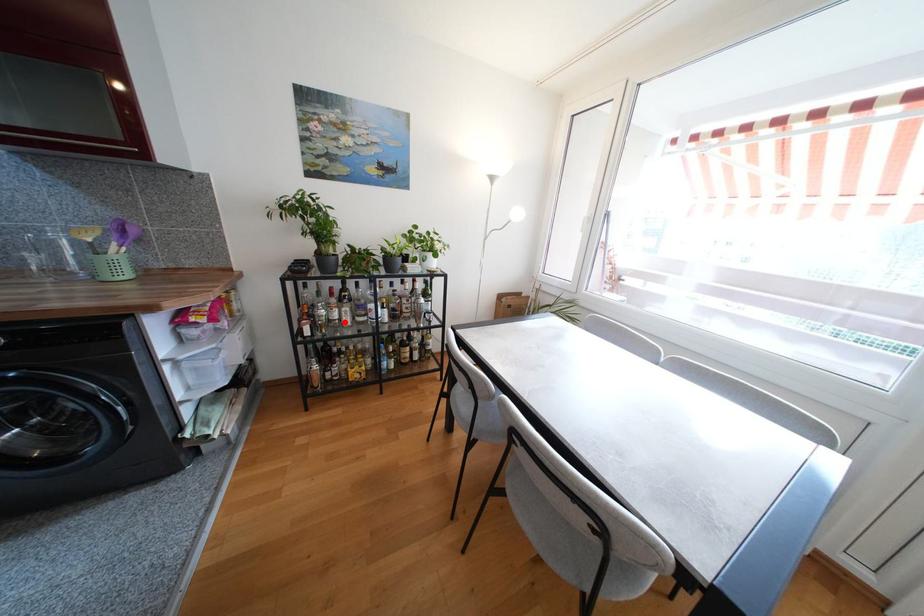
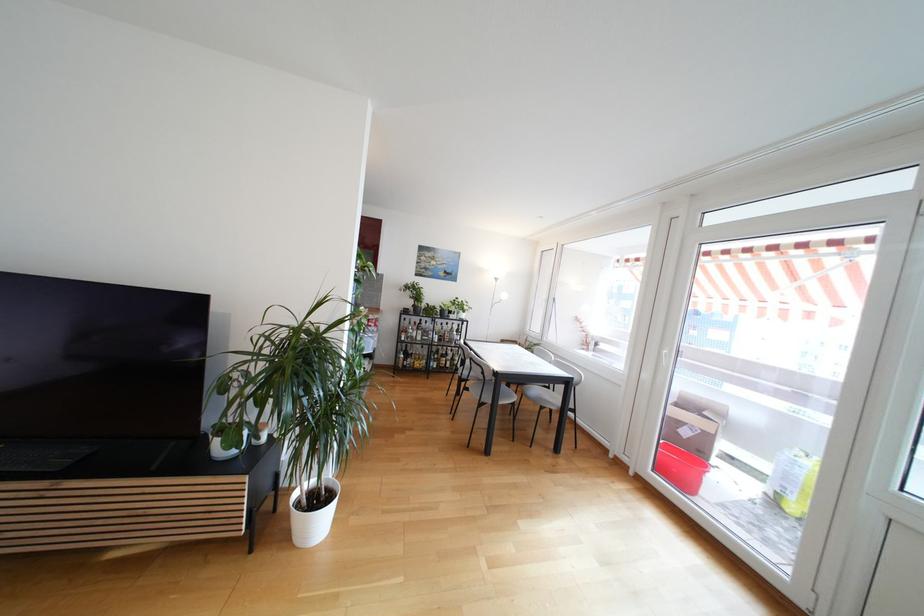
Question: I am providing you with two images of the same scene from different viewpoints. Image1 has a red point marked. In image2, the corresponding 3D location appears at what relative position? Reply with the corresponding letter.

Choices:
 (A) Closer
 (B) Farther

Answer: (B)